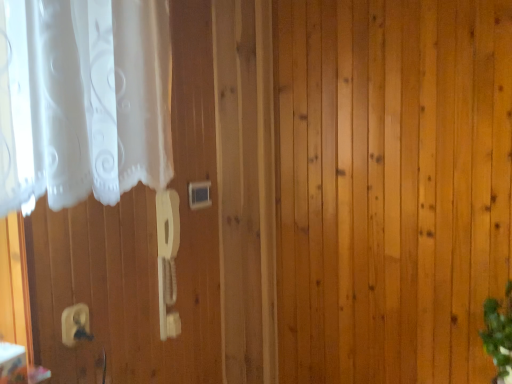
Where is `green leafy plant at lower right`? The height and width of the screenshot is (384, 512). green leafy plant at lower right is located at coordinates (499, 333).

The height and width of the screenshot is (384, 512). What do you see at coordinates (499, 333) in the screenshot? I see `green leafy plant at lower right` at bounding box center [499, 333].

You are a GUI agent. You are given a task and a screenshot of the screen. Output one action in this format:
    pyautogui.click(x=<x>, y=<y>)
    Task: Click on the green leafy plant at lower right
    The height and width of the screenshot is (384, 512).
    Given the screenshot: What is the action you would take?
    pyautogui.click(x=499, y=333)